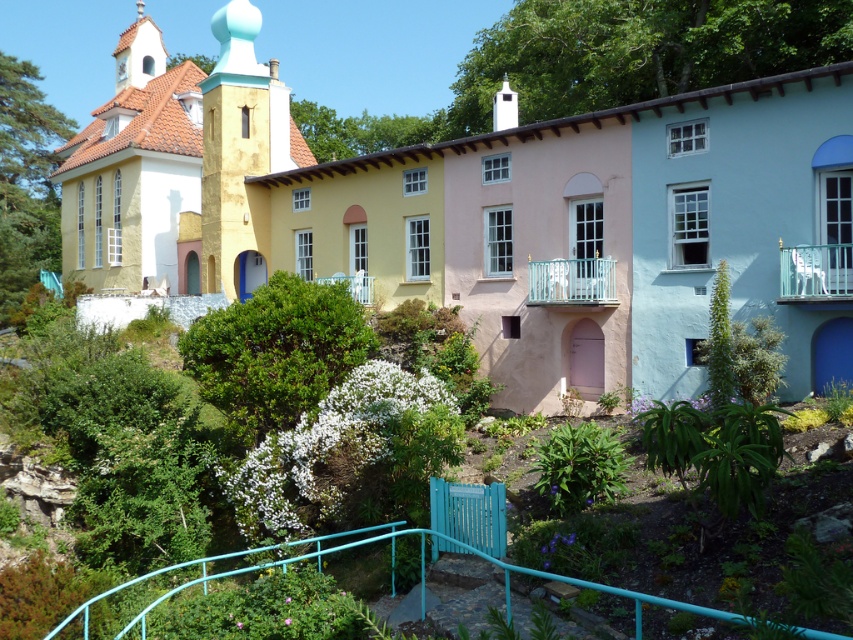
Is teal metal railing at lower center positioned in front of white stucco spire at upper left?

That is True.

Does teal metal railing at lower center have a greater height compared to white stucco spire at upper left?

No.

Does point (440, 532) come farther from viewer compared to point (152, 61)?

No, it is in front of (152, 61).

You are a GUI agent. You are given a task and a screenshot of the screen. Output one action in this format:
    pyautogui.click(x=<x>, y=<y>)
    Task: Click on the teal metal railing at lower center
    This screenshot has height=640, width=853.
    Given the screenshot: What is the action you would take?
    pyautogui.click(x=257, y=552)

Who is more forward, [160,243] or [436,532]?

Point [436,532] is in front.

What do you see at coordinates (175, 163) in the screenshot? The width and height of the screenshot is (853, 640). I see `matte yellow chapel at upper left` at bounding box center [175, 163].

You are a GUI agent. You are given a task and a screenshot of the screen. Output one action in this format:
    pyautogui.click(x=<x>, y=<y>)
    Task: Click on the matte yellow chapel at upper left
    The width and height of the screenshot is (853, 640).
    Given the screenshot: What is the action you would take?
    pyautogui.click(x=175, y=163)

Is matte yellow church at upper left above white stucco spire at upper left?

Incorrect, matte yellow church at upper left is not positioned above white stucco spire at upper left.

Describe the element at coordinates (550, 224) in the screenshot. The width and height of the screenshot is (853, 640). I see `matte yellow church at upper left` at that location.

Between point (73, 154) and point (137, 81), which one is positioned in front?

Point (137, 81) is in front.

In order to click on matte yellow church at upper left in this screenshot , I will do `click(550, 224)`.